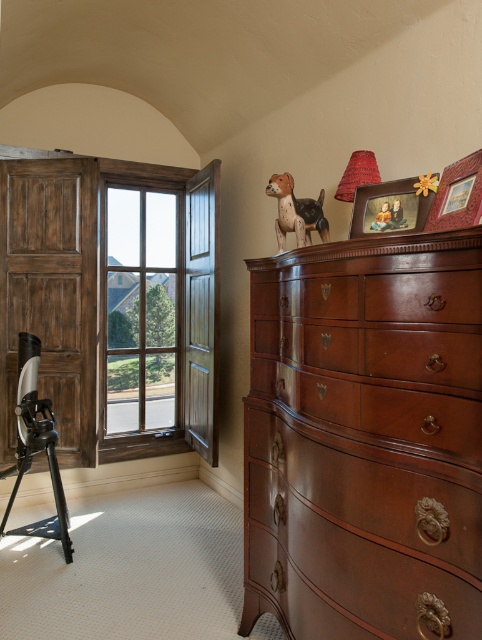
Question: Among these objects, which one is farthest from the camera?

Choices:
 (A) clear glass window at center
 (B) wooden picture frame at upper right
 (C) wooden picture frame at upper center
 (D) black matte tripod at left

Answer: (A)

Question: Does clear glass window at center appear over black matte tripod at left?

Choices:
 (A) no
 (B) yes

Answer: (B)

Question: Observing the image, what is the correct spatial positioning of clear glass window at center in reference to wooden picture frame at upper right?

Choices:
 (A) below
 (B) above

Answer: (A)

Question: Does clear glass window at center appear under wooden picture frame at upper right?

Choices:
 (A) no
 (B) yes

Answer: (B)

Question: Which point appears farthest from the camera in this image?

Choices:
 (A) (396, 211)
 (B) (478, 152)

Answer: (A)

Question: Which object is positioned closest to the wooden picture frame at upper center?

Choices:
 (A) mahogany wood dresser at right
 (B) wooden picture frame at upper right
 (C) black matte tripod at left
 (D) clear glass window at center

Answer: (B)